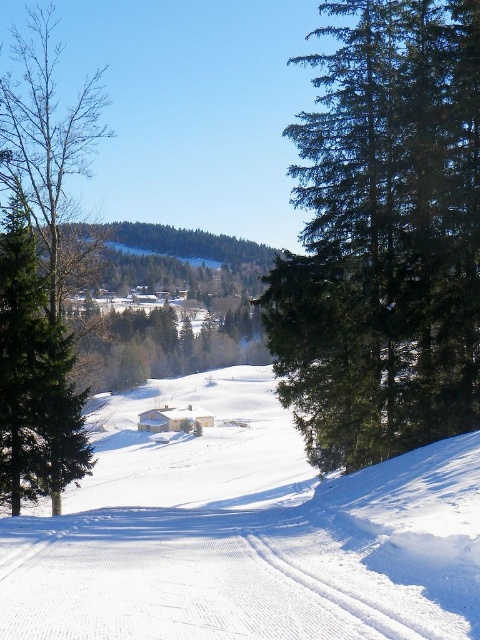
Question: In this image, where is white snow ski slope at center located relative to green matte tree at right?

Choices:
 (A) right
 (B) left

Answer: (B)

Question: Which of the following is the closest to the observer?

Choices:
 (A) green matte tree at right
 (B) white snow ski slope at center

Answer: (B)

Question: Which object appears farthest from the camera in this image?

Choices:
 (A) white snow ski slope at center
 (B) green matte tree at right
 (C) brown textured tree at left

Answer: (C)

Question: Observing the image, what is the correct spatial positioning of white snow ski slope at center in reference to green matte tree at right?

Choices:
 (A) right
 (B) left

Answer: (B)

Question: Does white snow ski slope at center have a larger size compared to brown textured tree at left?

Choices:
 (A) no
 (B) yes

Answer: (A)

Question: Which object is positioned closest to the white snow ski slope at center?

Choices:
 (A) green matte tree at right
 (B) brown textured tree at left

Answer: (A)